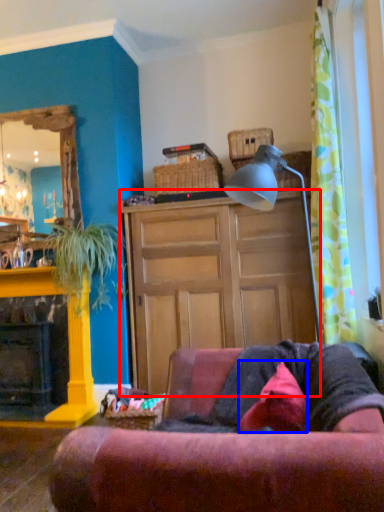
Question: Which point is further to the camera, cabinetry (highlighted by a red box) or pillow (highlighted by a blue box)?

Choices:
 (A) cabinetry
 (B) pillow

Answer: (A)